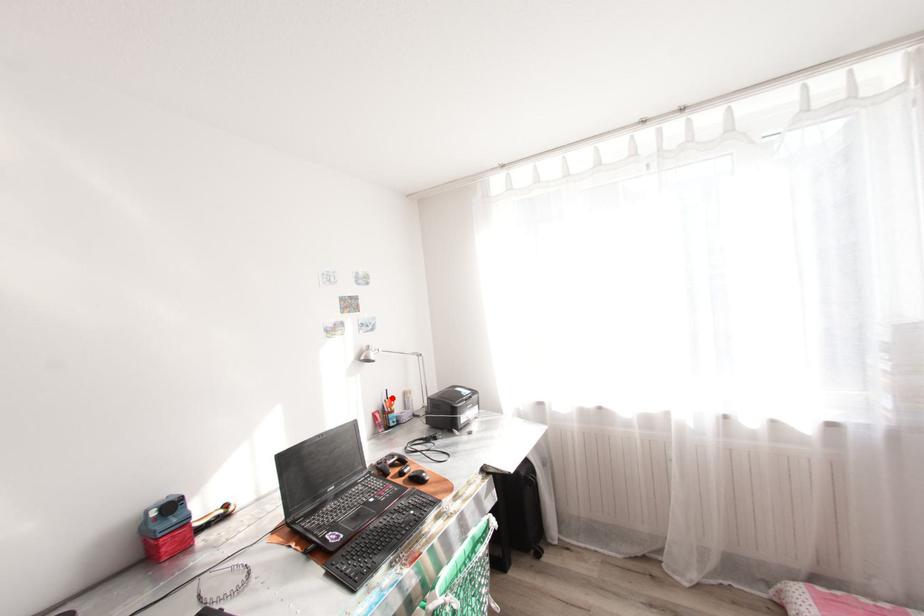
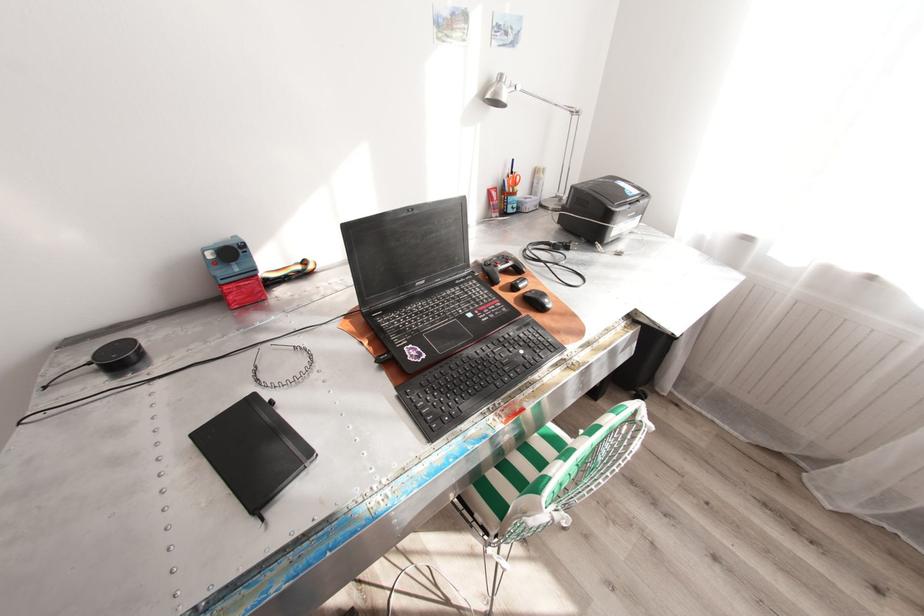
Question: A red point is marked in image1. In image2, is the corresponding 3D point closer to the camera or farther? Reply with the corresponding letter.

Choices:
 (A) The corresponding 3D point is closer.
 (B) The corresponding 3D point is farther.

Answer: (A)